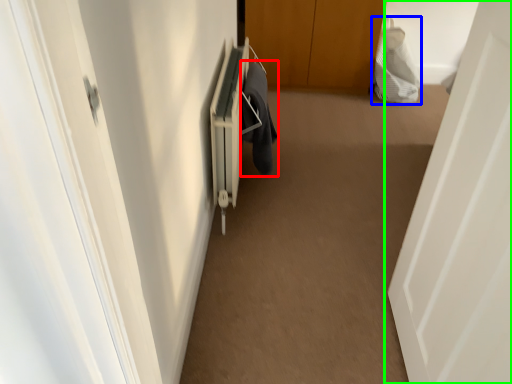
Question: Based on their relative distances, which object is farther from laundry (highlighted by a red box)? Choose from material (highlighted by a blue box) and door (highlighted by a green box).

Choices:
 (A) material
 (B) door

Answer: (A)